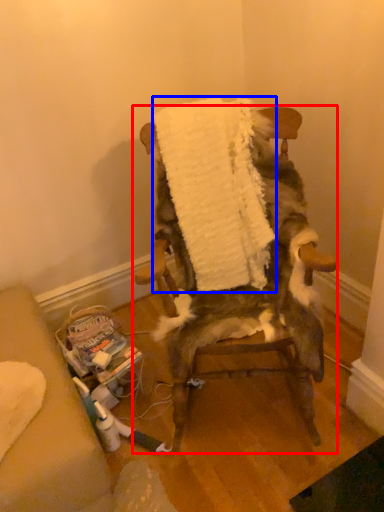
Question: Which object is closer to the camera taking this photo, chair (highlighted by a red box) or blanket (highlighted by a blue box)?

Choices:
 (A) chair
 (B) blanket

Answer: (A)